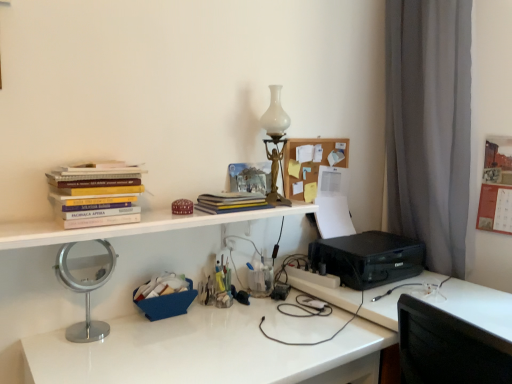
Identify the location of free point above white glossy desk at center (from a real-world perspective). (202, 342).